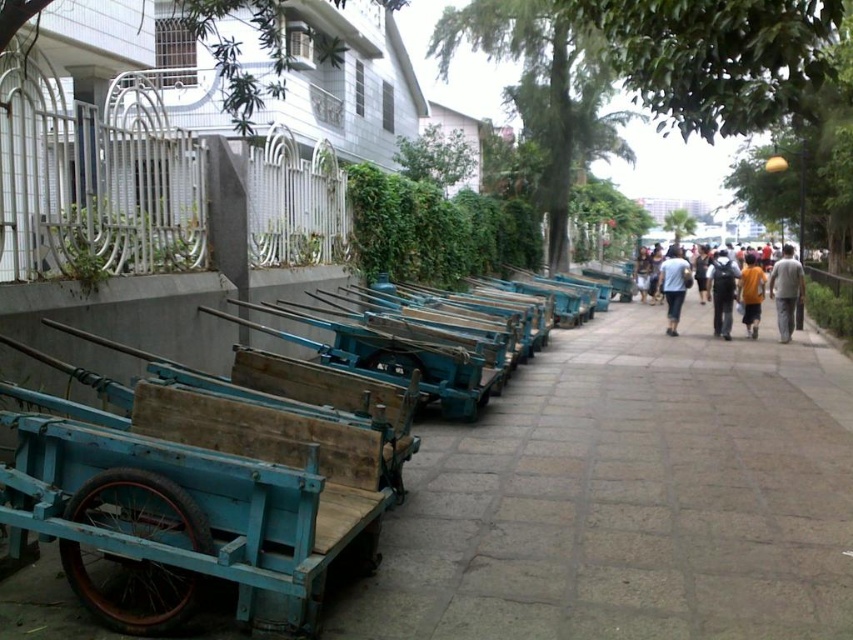
You are standing at the point marked as point [206,481] in the image. What object is directly in front of you?

The blue wooden wagon at center left is located at point [206,481], so the object directly in front of you is the blue wooden wagon at center left.